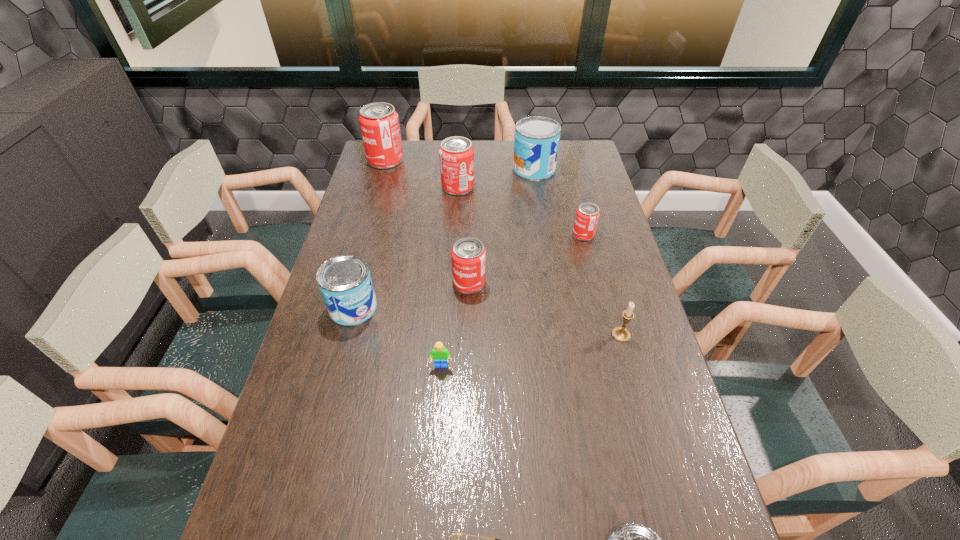
Image resolution: width=960 pixels, height=540 pixels. In order to click on the ninth closest object to the third biggest red can in this screenshot , I will do [632, 539].

Identify which can is the fourth nearest to the second smallest red can. Please provide its 2D coordinates. Your answer should be formatted as a tuple, i.e. [(x, y)], where the tuple contains the x and y coordinates of a point satisfying the conditions above.

[(536, 143)]

Locate an element on the screen. can identified as the sixth closest to the fourth farthest can is located at coordinates (632, 539).

Choose which red can is the fourth nearest neighbor to the second farthest blue can. Please provide its 2D coordinates. Your answer should be formatted as a tuple, i.e. [(x, y)], where the tuple contains the x and y coordinates of a point satisfying the conditions above.

[(379, 123)]

Identify the location of the third closest red can to the farthest red can. Image resolution: width=960 pixels, height=540 pixels. (587, 214).

This screenshot has height=540, width=960. Find the location of `blue can that can be found as the second closest to the rightmost red can`. blue can that can be found as the second closest to the rightmost red can is located at coordinates (345, 283).

Locate an element on the screen. The width and height of the screenshot is (960, 540). blue can object that ranks as the closest to the smallest blue can is located at coordinates (345, 283).

I want to click on vacant space that satisfies the following two spatial constraints: 1. on the back side of the farthest blue can; 2. on the left side of the nearest red can, so click(471, 168).